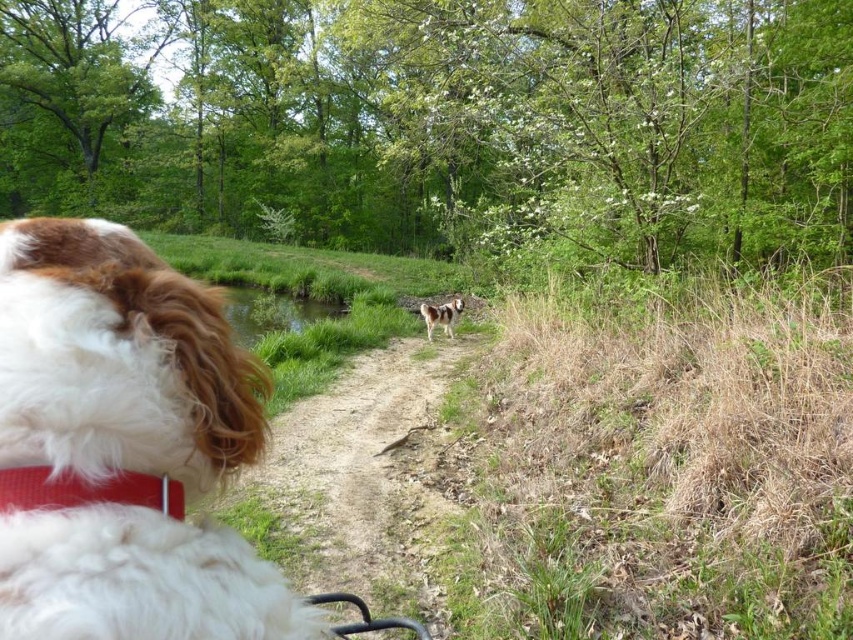
Question: Considering the real-world distances, which object is farthest from the dirt path at center?

Choices:
 (A) brown and white fur at center
 (B) red fabric neckband at lower left
 (C) white fluffy dog at center

Answer: (A)

Question: Which of the following is the closest to the observer?

Choices:
 (A) (10, 259)
 (B) (422, 312)
 (C) (51, 492)
 (D) (397, 406)

Answer: (C)

Question: Does dirt path at center have a smaller size compared to red fabric neckband at lower left?

Choices:
 (A) yes
 (B) no

Answer: (B)

Question: Among these points, which one is nearest to the camera?

Choices:
 (A) (141, 477)
 (B) (451, 316)
 (C) (109, 540)
 (D) (225, 506)

Answer: (C)

Question: In this image, where is white fluffy dog at center located relative to red fabric neckband at lower left?

Choices:
 (A) left
 (B) right

Answer: (A)

Question: Can you confirm if dirt path at center is positioned above red fabric neckband at lower left?

Choices:
 (A) no
 (B) yes

Answer: (A)